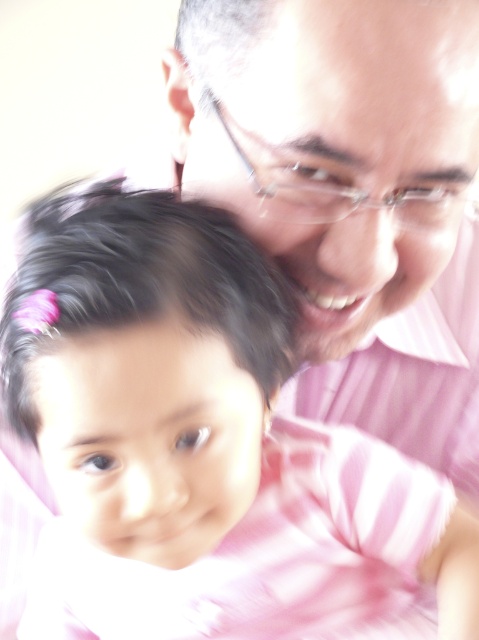
You are a fashion designer observing the image. You need to determine which item is bigger between the pink striped shirt at center and the clear plastic glasses at upper center. Which one is larger?

The pink striped shirt at center is larger in size than the clear plastic glasses at upper center.

You are a photographer trying to capture a clear shot of the pink striped shirt at center. Your camera has a minimum focus distance of 14 inches. Will you need to move further away to get a clear picture?

The pink striped shirt at center is currently 12.90 inches away from the camera. Since this is less than the minimum focus distance of 14 inches, you need to move further away or adjust the camera settings to ensure the shirt is in focus.

You are standing in the room and see the adult and child. There is a point at coordinates (x=196, y=440). Where is this point located?

The point at coordinates (x=196, y=440) is located on the pink striped shirt at center.